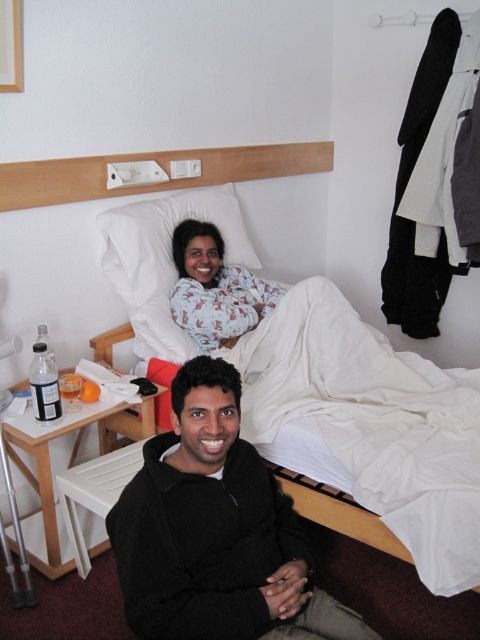
You are a hotel employee checking the room layout. You need to place a 1.2 meter tall decorative plant between the white cotton bed at upper center and the black fleece jacket at lower center. Is there enough vertical space between them for the plant?

The white cotton bed at upper center is taller than the black fleece jacket at lower center. Since the plant is 1.2 meters tall, the vertical space between them must accommodate this height. However, without specific measurements of the distance between the two objects, it is impossible to confirm if there is sufficient space. Please measure the vertical gap before placing the plant.

You are a hotel employee who needs to ensure that the white cotton pajamas at upper center can fit neatly on the white cotton bed at upper center. Based on their sizes, will the pajamas fit without any issues?

The white cotton bed at upper center is wider than the white cotton pajamas at upper center, so the pajamas will fit neatly on the bed without any issues.